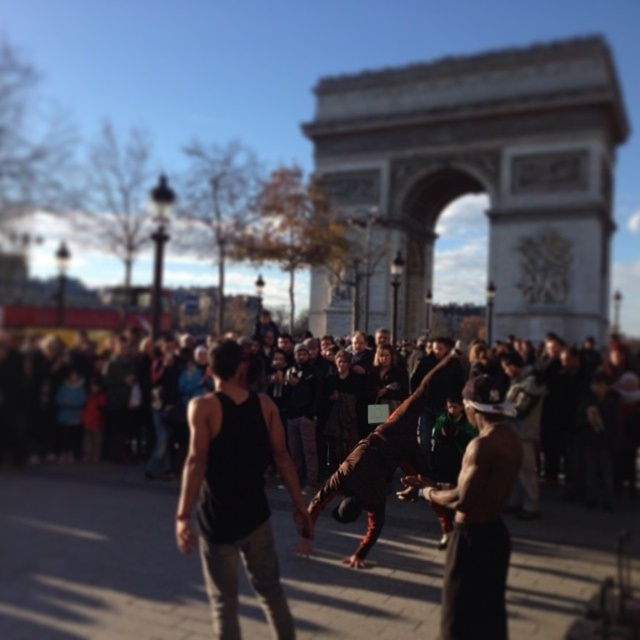
Which of these two, dark brown leather jacket at center or shiny metallic helmet at center, stands shorter?

dark brown leather jacket at center

Who is more forward, (141, 440) or (461, 516)?

Point (461, 516)

Does point (184, 412) come farther from viewer compared to point (488, 605)?

Yes.

Image resolution: width=640 pixels, height=640 pixels. Find the location of `dark brown leather jacket at center`. dark brown leather jacket at center is located at coordinates (90, 396).

Can you confirm if black tank top at center is bigger than shiny metallic helmet at center?

Yes, black tank top at center is bigger than shiny metallic helmet at center.

Can you confirm if black tank top at center is shorter than shiny metallic helmet at center?

In fact, black tank top at center may be taller than shiny metallic helmet at center.

This screenshot has height=640, width=640. What do you see at coordinates (236, 492) in the screenshot?
I see `black tank top at center` at bounding box center [236, 492].

The image size is (640, 640). I want to click on black tank top at center, so click(x=236, y=492).

Based on the photo, how far apart are shiny metallic helmet at center and brown leather jacket at center?

shiny metallic helmet at center and brown leather jacket at center are 7.18 meters apart from each other.

Does shiny metallic helmet at center appear on the left side of brown leather jacket at center?

In fact, shiny metallic helmet at center is to the right of brown leather jacket at center.

Between point (477, 532) and point (304, 541), which one is positioned in front?

Point (477, 532) is in front.

Image resolution: width=640 pixels, height=640 pixels. In order to click on shiny metallic helmet at center in this screenshot , I will do `click(476, 516)`.